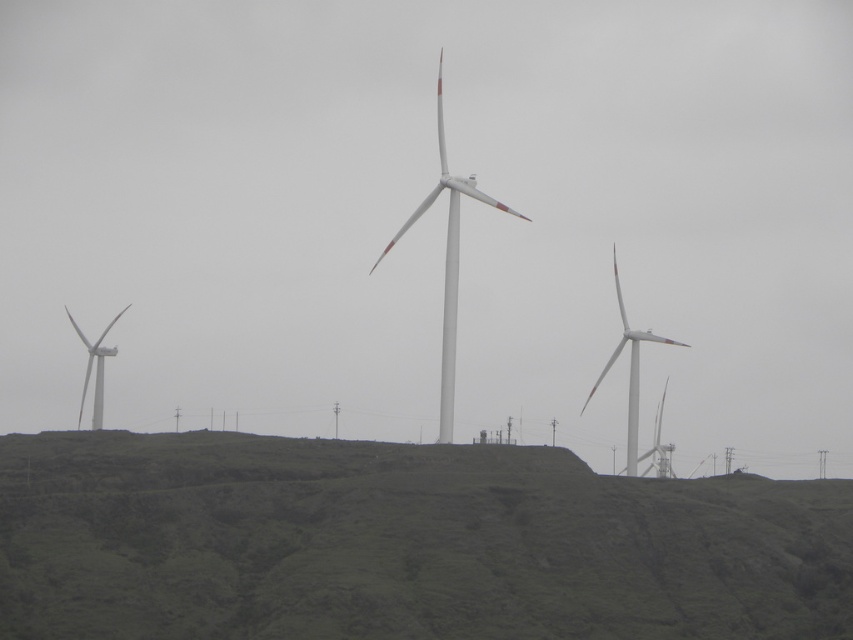
Question: Which object appears closest to the camera in this image?

Choices:
 (A) green grassy hillside at center
 (B) white matte windmill at left
 (C) white matte windmill at center
 (D) white matte windmill at right

Answer: (A)

Question: Is white matte windmill at center smaller than white matte windmill at left?

Choices:
 (A) no
 (B) yes

Answer: (A)

Question: Considering the relative positions of white matte windmill at center and white matte windmill at left in the image provided, where is white matte windmill at center located with respect to white matte windmill at left?

Choices:
 (A) below
 (B) above

Answer: (B)

Question: Which object is the farthest from the green grassy hillside at center?

Choices:
 (A) white matte windmill at right
 (B) white matte windmill at left

Answer: (B)

Question: Where is green grassy hillside at center located in relation to white matte windmill at right in the image?

Choices:
 (A) below
 (B) above

Answer: (A)

Question: Estimate the real-world distances between objects in this image. Which object is farther from the white matte windmill at right?

Choices:
 (A) white matte windmill at center
 (B) green grassy hillside at center
 (C) white matte windmill at left

Answer: (B)